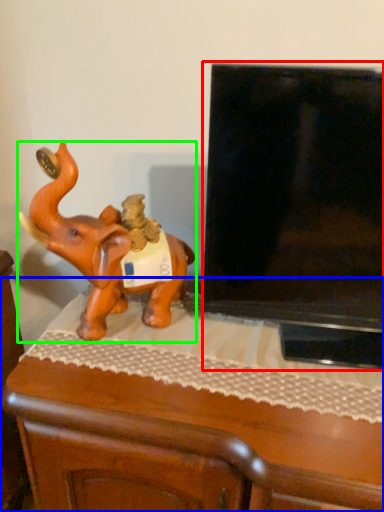
Question: Which object is the closest to the television (highlighted by a red box)? Choose among these: furniture (highlighted by a blue box) or elephant (highlighted by a green box).

Choices:
 (A) furniture
 (B) elephant

Answer: (A)